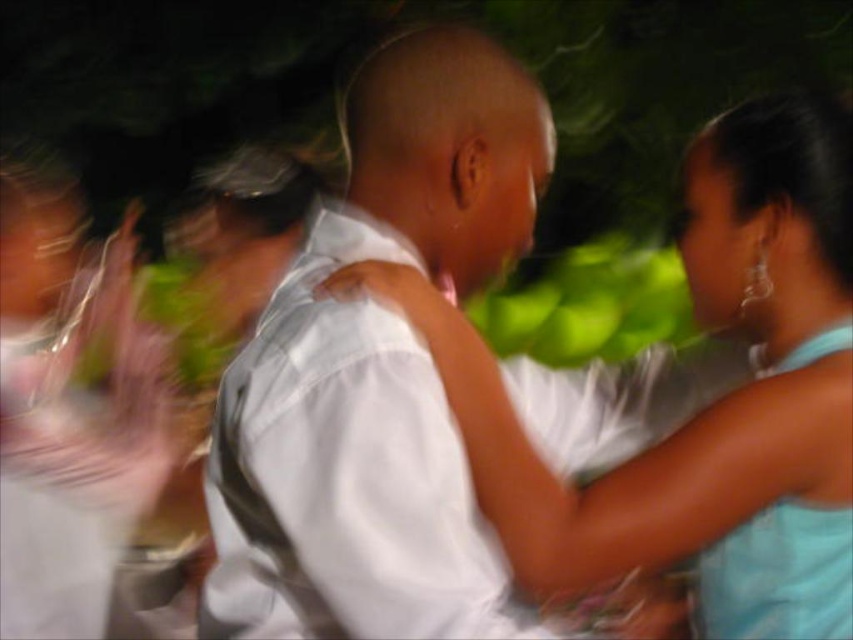
Question: Which point is closer to the camera?

Choices:
 (A) white smooth shirt at center
 (B) light blue satin dress at center
 (C) light blue satin dress at right

Answer: (A)

Question: Is white smooth shirt at center to the right of light blue satin dress at center from the viewer's perspective?

Choices:
 (A) yes
 (B) no

Answer: (B)

Question: Which of the following is the farthest from the observer?

Choices:
 (A) (384, 371)
 (B) (846, 324)
 (C) (770, 588)

Answer: (B)

Question: Does white smooth shirt at center appear over light blue satin dress at right?

Choices:
 (A) no
 (B) yes

Answer: (B)

Question: Which point appears closest to the camera in this image?

Choices:
 (A) (767, 292)
 (B) (848, 317)

Answer: (B)

Question: Is white smooth shirt at center in front of light blue satin dress at center?

Choices:
 (A) yes
 (B) no

Answer: (A)